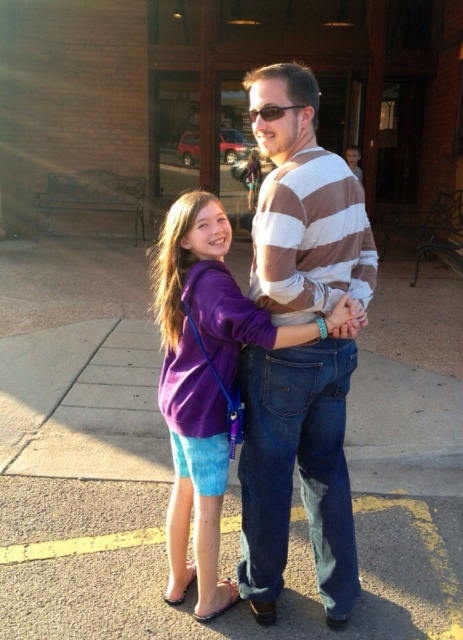
Question: Is smooth concrete pavement at center to the right of purple cotton hoodie at center from the viewer's perspective?

Choices:
 (A) no
 (B) yes

Answer: (B)

Question: Is smooth concrete pavement at center further to camera compared to matte purple shirt at center?

Choices:
 (A) no
 (B) yes

Answer: (B)

Question: Which of the following is the closest to the observer?

Choices:
 (A) pyautogui.click(x=91, y=524)
 (B) pyautogui.click(x=346, y=589)

Answer: (B)

Question: Considering the real-world distances, which object is closest to the purple cotton hoodie at center?

Choices:
 (A) smooth concrete pavement at center
 (B) matte purple shirt at center

Answer: (B)

Question: Is purple cotton hoodie at center wider than matte purple shirt at center?

Choices:
 (A) no
 (B) yes

Answer: (B)

Question: Which object appears closest to the camera in this image?

Choices:
 (A) striped cotton shirt at center
 (B) matte purple shirt at center
 (C) smooth concrete pavement at center

Answer: (A)